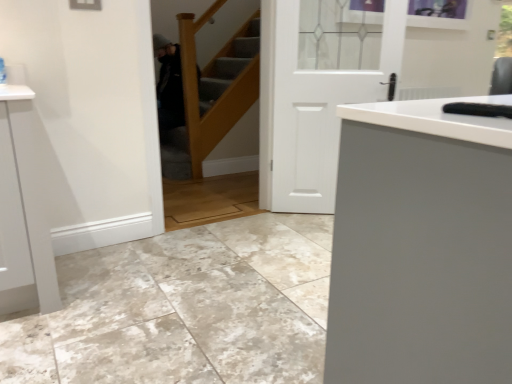
Question: Would you say white wooden door at center is inside or outside wooden stairwell at center?

Choices:
 (A) outside
 (B) inside

Answer: (A)

Question: From their relative heights in the image, would you say white wooden door at center is taller or shorter than wooden stairwell at center?

Choices:
 (A) tall
 (B) short

Answer: (B)

Question: Does point (297, 107) appear closer or farther from the camera than point (164, 173)?

Choices:
 (A) closer
 (B) farther

Answer: (A)

Question: From a real-world perspective, relative to white wooden door at center, is wooden stairwell at center vertically above or below?

Choices:
 (A) above
 (B) below

Answer: (A)

Question: From the image's perspective, is wooden stairwell at center above or below white wooden door at center?

Choices:
 (A) below
 (B) above

Answer: (B)

Question: From their relative heights in the image, would you say wooden stairwell at center is taller or shorter than white wooden door at center?

Choices:
 (A) tall
 (B) short

Answer: (A)

Question: Relative to white wooden door at center, is wooden stairwell at center in front or behind?

Choices:
 (A) behind
 (B) front

Answer: (B)